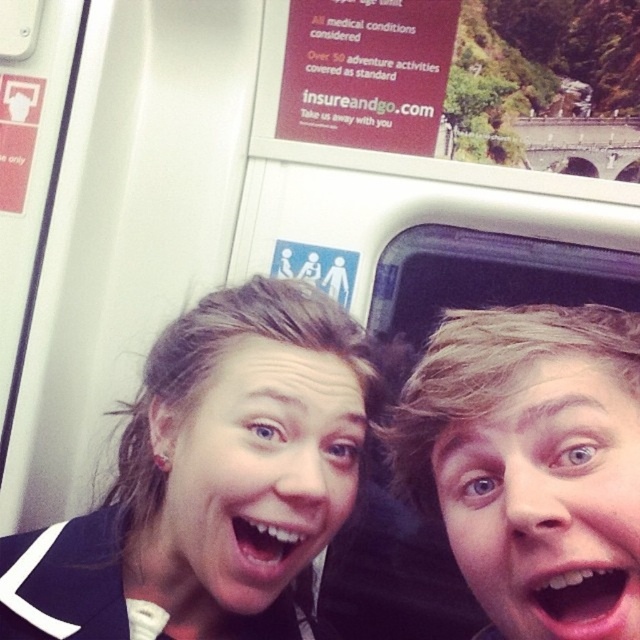
Does black fabric at center have a lesser width compared to white glossy teeth at center?

No, black fabric at center is not thinner than white glossy teeth at center.

Is point (168, 396) positioned after point (253, 528)?

Yes, point (168, 396) is behind point (253, 528).

At what (x,y) coordinates should I click in order to perform the action: click on black fabric at center. Please return your answer as a coordinate pair (x, y). Looking at the image, I should click on (209, 476).

The height and width of the screenshot is (640, 640). I want to click on black fabric at center, so click(209, 476).

Does point (157, 412) come behind point (572, 404)?

Yes.

Is black fabric at center taller than blonde hair at right?

Correct, black fabric at center is much taller as blonde hair at right.

Is point (118, 596) farther from viewer compared to point (444, 426)?

Yes, point (118, 596) is behind point (444, 426).

The height and width of the screenshot is (640, 640). What are the coordinates of `black fabric at center` in the screenshot? It's located at (209, 476).

From the picture: Who is more distant from viewer, (620, 612) or (268, 529)?

The point (268, 529) is more distant.

Which is above, pink glossy lips at center or white glossy teeth at center?

pink glossy lips at center is above.

You are a GUI agent. You are given a task and a screenshot of the screen. Output one action in this format:
    pyautogui.click(x=<x>, y=<y>)
    Task: Click on the pink glossy lips at center
    
    Given the screenshot: What is the action you would take?
    pyautogui.click(x=582, y=602)

Locate an element on the screen. pink glossy lips at center is located at coordinates (582, 602).